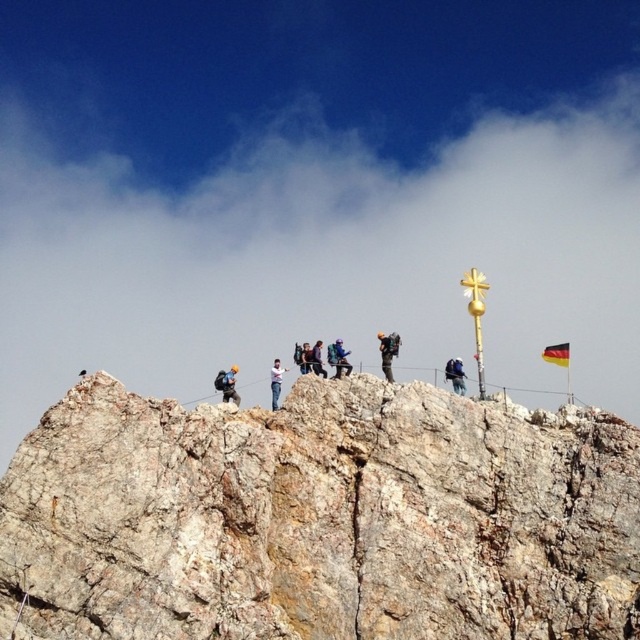
Can you confirm if gray rough rock at center is taller than dark blue jacket at center?

Yes.

Between gray rough rock at center and dark blue jacket at center, which one appears on the left side from the viewer's perspective?

gray rough rock at center is more to the left.

Locate an element on the screen. The height and width of the screenshot is (640, 640). gray rough rock at center is located at coordinates [320, 518].

Is blue fabric backpack at center taller than dark blue jacket at center?

In fact, blue fabric backpack at center may be shorter than dark blue jacket at center.

Is blue fabric backpack at center above dark blue jacket at center?

Indeed, blue fabric backpack at center is positioned over dark blue jacket at center.

Who is more distant from viewer, (330, 356) or (452, 364)?

The point (452, 364) is more distant.

Image resolution: width=640 pixels, height=640 pixels. Identify the location of blue fabric backpack at center. (339, 358).

In the scene shown: Can you confirm if light blue fabric backpack at center is wider than blue fabric jacket at center?

Yes, light blue fabric backpack at center is wider than blue fabric jacket at center.

Between light blue fabric backpack at center and blue fabric jacket at center, which one is positioned lower?

Positioned lower is light blue fabric backpack at center.

Does point (216, 380) come behind point (310, 356)?

Yes, it is.

Image resolution: width=640 pixels, height=640 pixels. I want to click on light blue fabric backpack at center, so click(x=227, y=385).